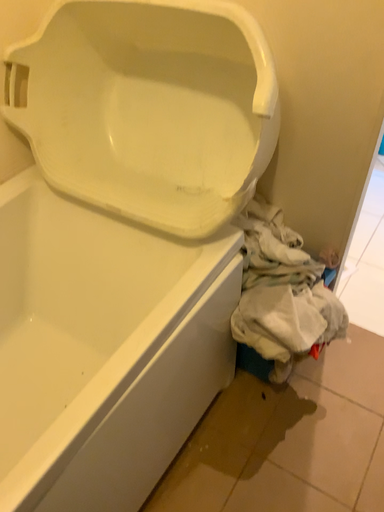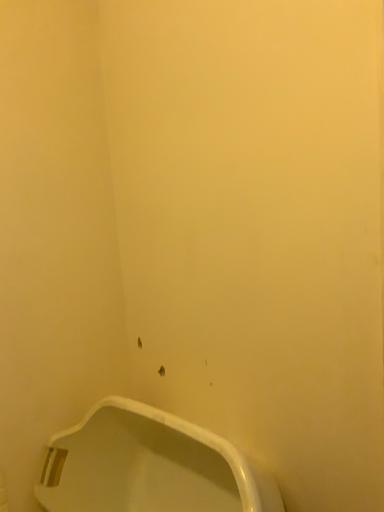
Question: Which way did the camera rotate in the video?

Choices:
 (A) rotated downward
 (B) rotated upward

Answer: (B)